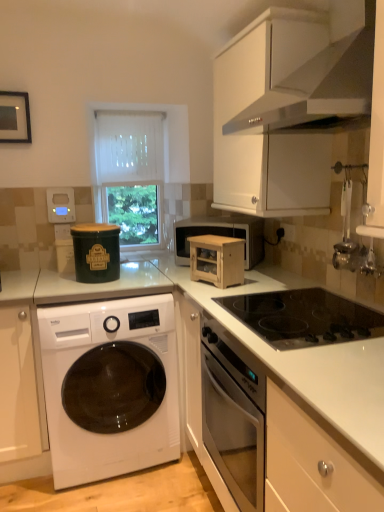
Locate an element on the screen. empty space that is ontop of white matte cabinet at lower left, the 1th cabinetry in the left-to-right sequence (from a real-world perspective) is located at coordinates (13, 284).